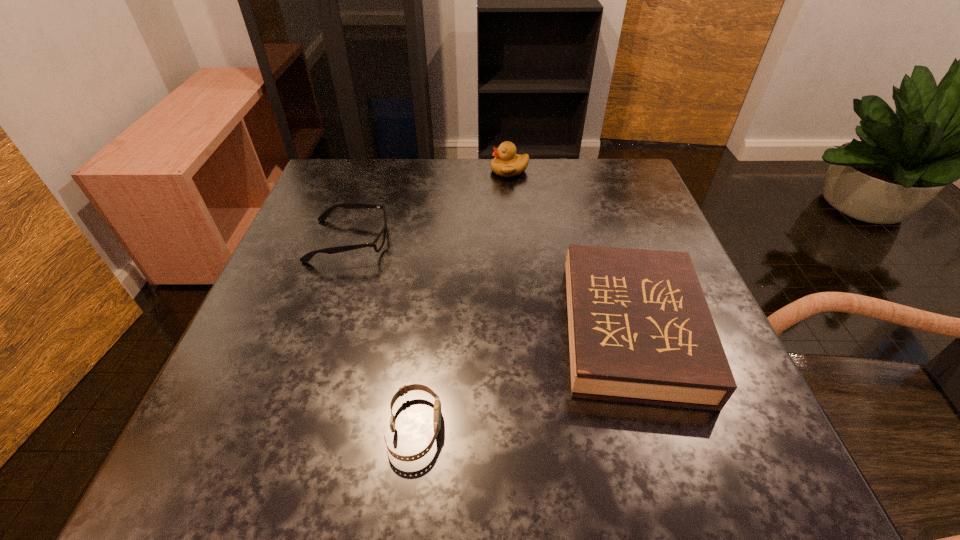
Where is `vacant space at the far left corner`? The height and width of the screenshot is (540, 960). vacant space at the far left corner is located at coordinates (377, 165).

You are a GUI agent. You are given a task and a screenshot of the screen. Output one action in this format:
    pyautogui.click(x=<x>, y=<y>)
    Task: Click on the vacant space at the far right corner of the desktop
    
    Given the screenshot: What is the action you would take?
    pyautogui.click(x=602, y=206)

At what (x,y) coordinates should I click in order to perform the action: click on vacant area between the spectacles and the duckling. Please return your answer as a coordinate pair (x, y). Looking at the image, I should click on (429, 206).

This screenshot has height=540, width=960. Identify the location of free spot between the rightmost object and the watch. (523, 379).

You are a GUI agent. You are given a task and a screenshot of the screen. Output one action in this format:
    pyautogui.click(x=<x>, y=<y>)
    Task: Click on the vacant space in between the third object from right to left and the spectacles
    Image resolution: width=960 pixels, height=540 pixels.
    Given the screenshot: What is the action you would take?
    pyautogui.click(x=382, y=335)

The image size is (960, 540). Identify the location of vacant region between the second farthest object and the second object from right to left. (429, 206).

Find the location of a particular element. This screenshot has width=960, height=540. vacant space that is in between the second farthest object and the farthest object is located at coordinates (429, 206).

Identify the location of unoccupied position between the rightmost object and the third object from right to left. (523, 379).

Locate an element on the screen. This screenshot has width=960, height=540. vacant area that lies between the leftmost object and the watch is located at coordinates (382, 335).

Locate an element on the screen. The height and width of the screenshot is (540, 960). object that is the third closest one to the farthest object is located at coordinates (437, 404).